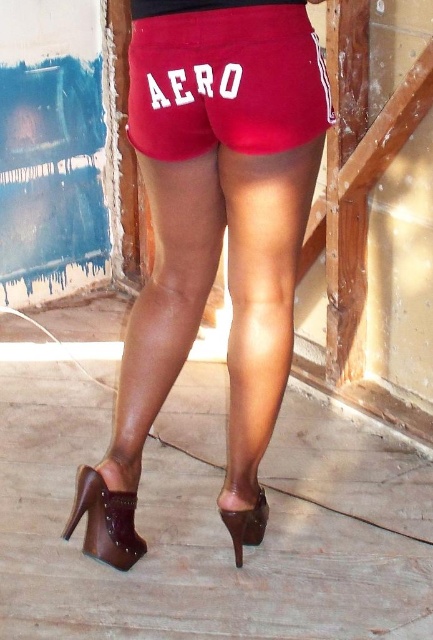
You are a fashion designer analyzing a photo of a person wearing red shorts with white stripes and brown studded high heels. The photo also shows a wooden structure in the background. You notice a point marked at coordinates (212, 230). According to the image, what is this point located on?

The point at (212, 230) is located on the matte leather shorts at center.